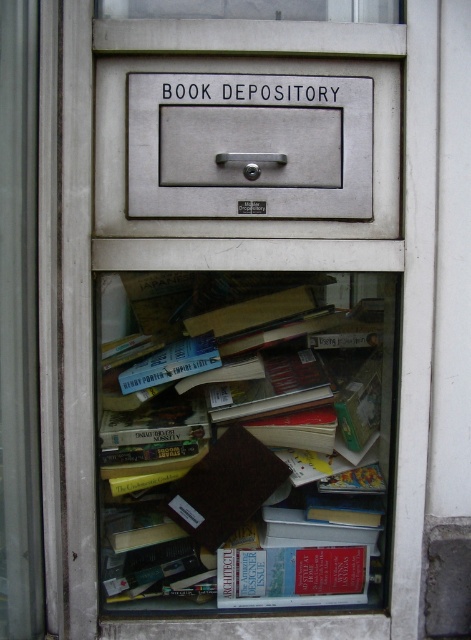
Question: Where is brown paper bag at center located in relation to metallic gray drawer at upper center in the image?

Choices:
 (A) right
 (B) left

Answer: (B)

Question: Does brown paper bag at center lie in front of metallic gray drawer at upper center?

Choices:
 (A) no
 (B) yes

Answer: (A)

Question: Among these points, which one is nearest to the camera?

Choices:
 (A) (242, 404)
 (B) (276, 177)

Answer: (B)

Question: Which of the following is the closest to the observer?

Choices:
 (A) (332, 291)
 (B) (352, 131)

Answer: (B)

Question: Which point is closer to the camera?

Choices:
 (A) metallic gray drawer at upper center
 (B) brown paper bag at center

Answer: (A)

Question: Is brown paper bag at center closer to camera compared to metallic gray drawer at upper center?

Choices:
 (A) no
 (B) yes

Answer: (A)